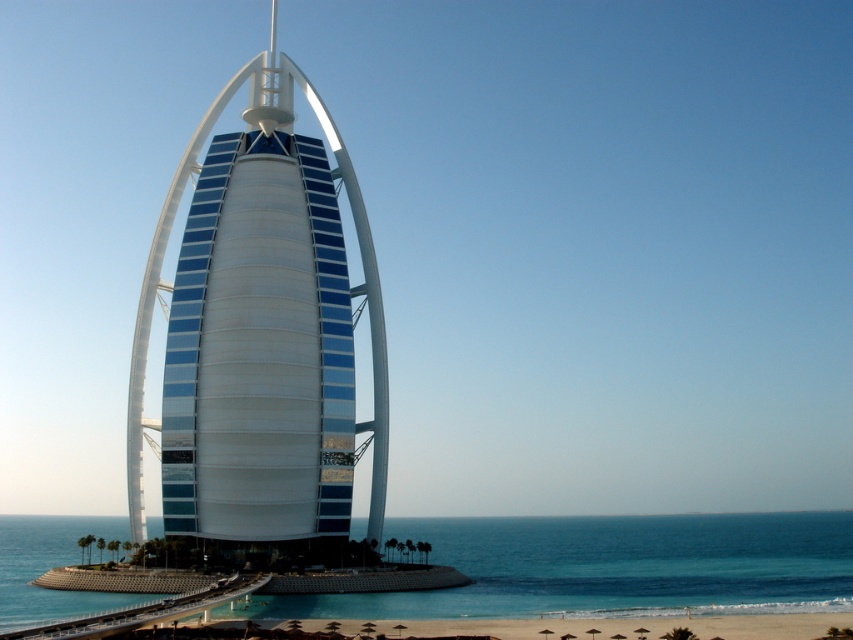
Can you confirm if white glossy tower at center is positioned below clear blue water at lower center?

No.

At what (x,y) coordinates should I click in order to perform the action: click on white glossy tower at center. Please return your answer as a coordinate pair (x, y). The height and width of the screenshot is (640, 853). Looking at the image, I should click on (260, 337).